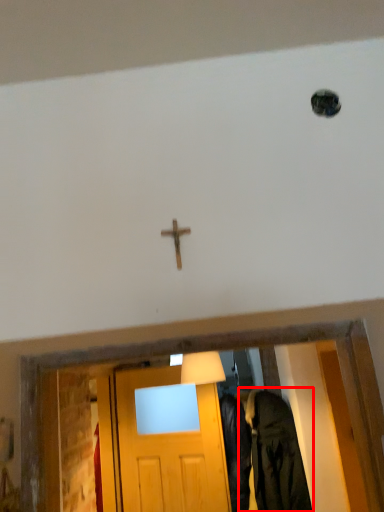
Question: Observing the image, what is the correct spatial positioning of clothing (annotated by the red box) in reference to crucifix?

Choices:
 (A) left
 (B) right

Answer: (B)